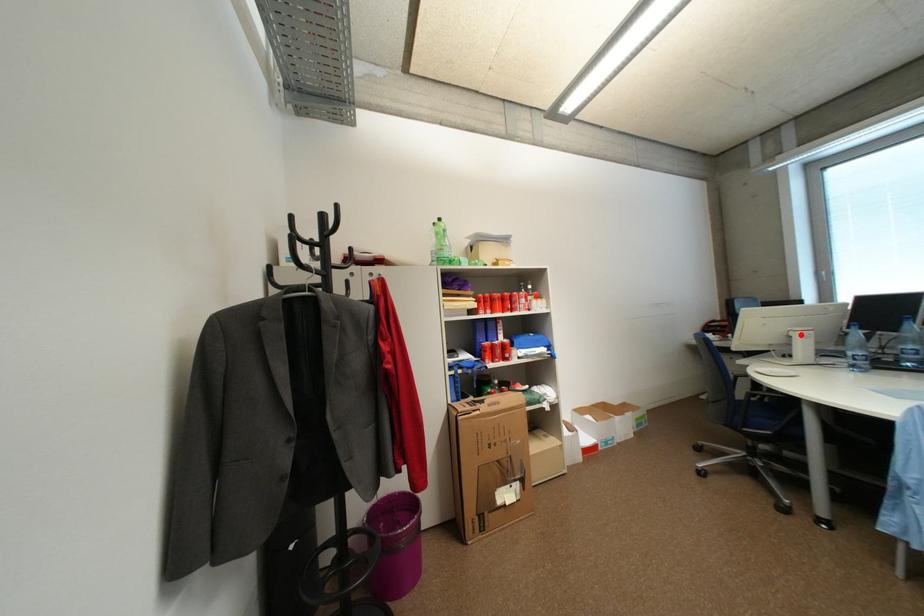
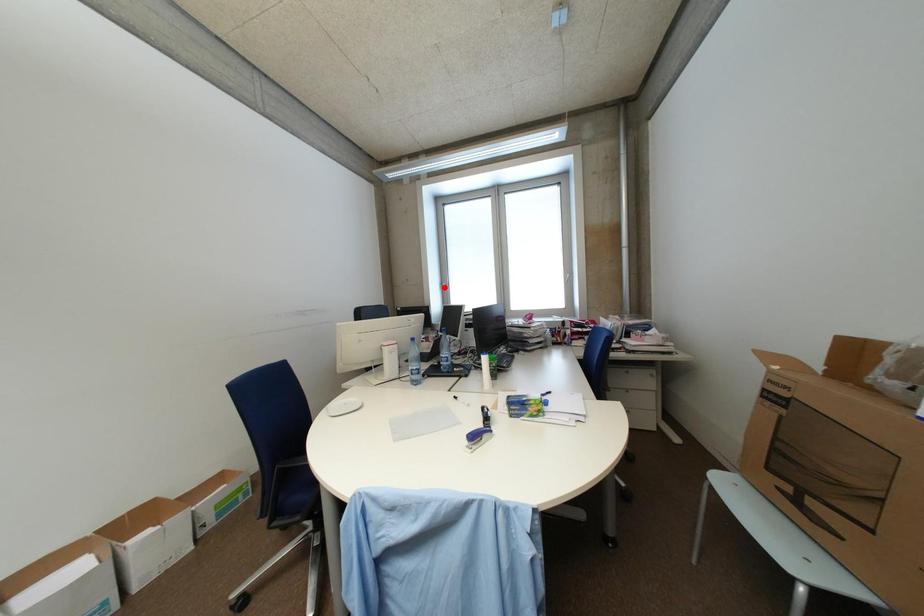
I am providing you with two images of the same scene from different viewpoints. A red point is marked on the first image and another point is marked on the second image. Is the marked point in image1 the same physical position as the marked point in image2?

No